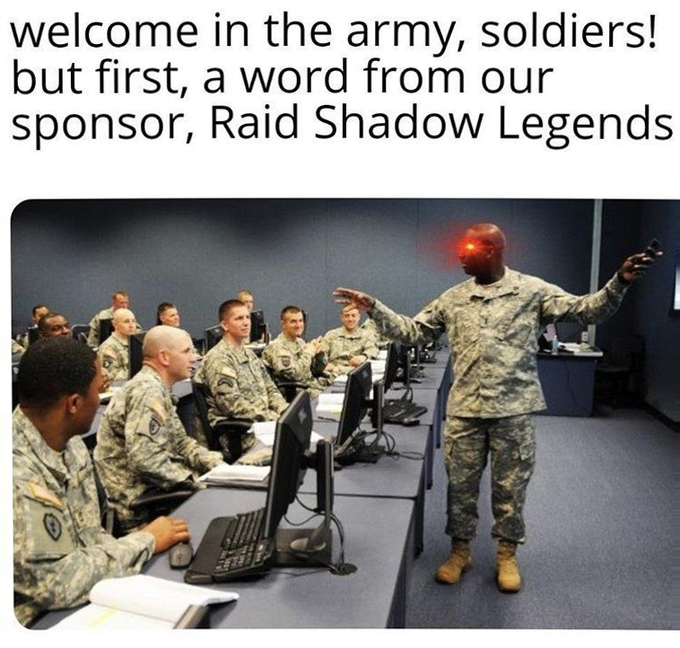
What are the coordinates of `gray desks` in the screenshot? It's located at (337, 592), (389, 468), (423, 397), (430, 378), (443, 352).